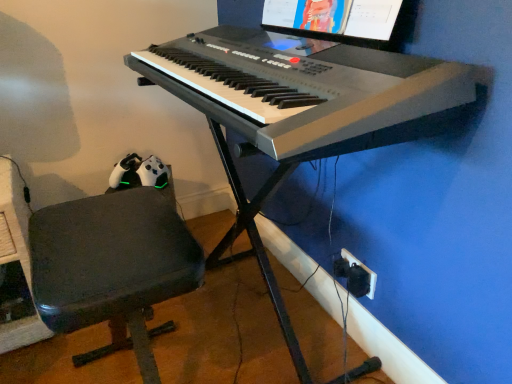
Question: Is dark gray fabric chair at lower left taller than white plastic keyboard at center?

Choices:
 (A) yes
 (B) no

Answer: (A)

Question: Does dark gray fabric chair at lower left have a lesser height compared to white plastic keyboard at center?

Choices:
 (A) yes
 (B) no

Answer: (B)

Question: Can you confirm if dark gray fabric chair at lower left is wider than white plastic keyboard at center?

Choices:
 (A) no
 (B) yes

Answer: (A)

Question: Is dark gray fabric chair at lower left positioned behind white plastic keyboard at center?

Choices:
 (A) no
 (B) yes

Answer: (B)

Question: Considering the relative positions of dark gray fabric chair at lower left and white plastic keyboard at center in the image provided, is dark gray fabric chair at lower left to the left of white plastic keyboard at center from the viewer's perspective?

Choices:
 (A) yes
 (B) no

Answer: (A)

Question: Is black plastic plug at lower right taller or shorter than white plastic keyboard at center?

Choices:
 (A) tall
 (B) short

Answer: (B)

Question: Looking at the image, does black plastic plug at lower right seem bigger or smaller compared to white plastic keyboard at center?

Choices:
 (A) big
 (B) small

Answer: (B)

Question: From a real-world perspective, is black plastic plug at lower right positioned above or below white plastic keyboard at center?

Choices:
 (A) above
 (B) below

Answer: (B)

Question: Considering the positions of point pyautogui.click(x=351, y=276) and point pyautogui.click(x=266, y=92), is point pyautogui.click(x=351, y=276) closer or farther from the camera than point pyautogui.click(x=266, y=92)?

Choices:
 (A) farther
 (B) closer

Answer: (A)

Question: In the image, is dark gray fabric chair at lower left positioned in front of or behind white plastic keyboard at center?

Choices:
 (A) front
 (B) behind

Answer: (B)

Question: In the image, is dark gray fabric chair at lower left on the left side or the right side of white plastic keyboard at center?

Choices:
 (A) right
 (B) left

Answer: (B)

Question: Considering the positions of dark gray fabric chair at lower left and white plastic keyboard at center in the image, is dark gray fabric chair at lower left bigger or smaller than white plastic keyboard at center?

Choices:
 (A) small
 (B) big

Answer: (B)

Question: From a real-world perspective, is dark gray fabric chair at lower left positioned above or below white plastic keyboard at center?

Choices:
 (A) below
 (B) above

Answer: (A)

Question: From a real-world perspective, is white plastic keyboard at center above or below matte black monitor at upper center?

Choices:
 (A) below
 (B) above

Answer: (A)

Question: Is white plastic keyboard at center spatially inside matte black monitor at upper center, or outside of it?

Choices:
 (A) outside
 (B) inside

Answer: (A)